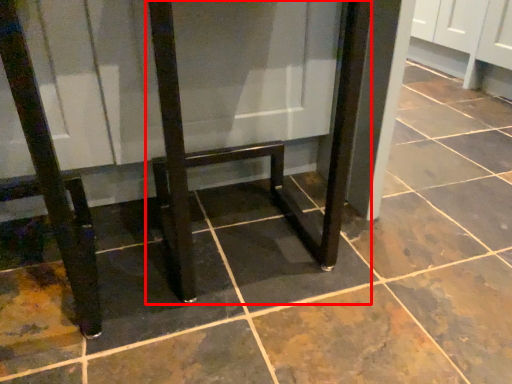
Question: From the image's perspective, where is furniture (annotated by the red box) located in relation to furniture in the image?

Choices:
 (A) above
 (B) below

Answer: (B)